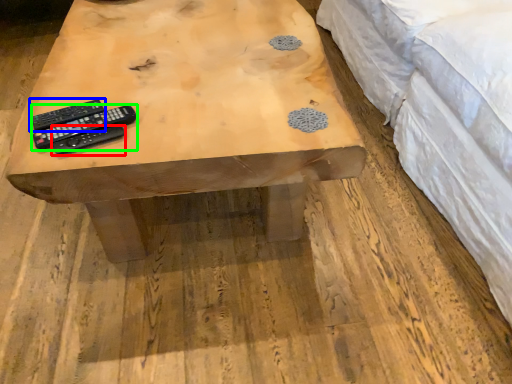
Question: Considering the real-world distances, which object is farthest from remote control (highlighted by a red box)? remote control (highlighted by a blue box) or remote control (highlighted by a green box)?

Choices:
 (A) remote control
 (B) remote control

Answer: (A)